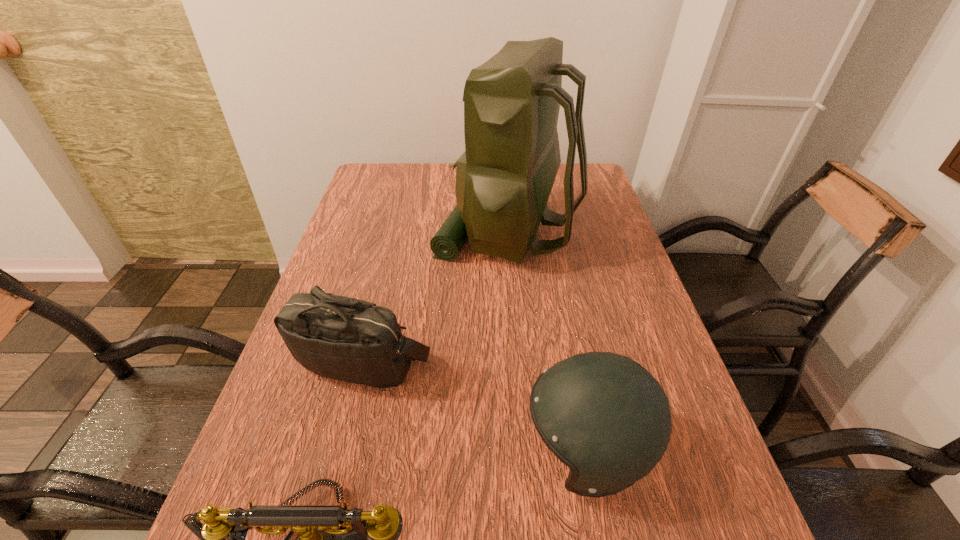
Where is `free space between the football helmet and the third nearest object`? The image size is (960, 540). free space between the football helmet and the third nearest object is located at coordinates (474, 407).

What are the coordinates of `free area in between the second farthest object and the football helmet` in the screenshot? It's located at (474, 407).

Locate an element on the screen. unoccupied position between the second farthest object and the football helmet is located at coordinates (474, 407).

Locate an element on the screen. This screenshot has width=960, height=540. vacant area that lies between the football helmet and the third nearest object is located at coordinates (474, 407).

Find the location of a particular element. This screenshot has width=960, height=540. unoccupied area between the football helmet and the farthest object is located at coordinates (547, 341).

Image resolution: width=960 pixels, height=540 pixels. I want to click on vacant region between the tallest object and the shoulder bag, so click(435, 297).

In order to click on vacant area that lies between the farthest object and the shoulder bag in this screenshot , I will do pyautogui.click(x=435, y=297).

Where is `object that ranks as the second closest to the farthest object`? object that ranks as the second closest to the farthest object is located at coordinates (603, 415).

Identify which object is the closest to the shoulder bag. Please provide its 2D coordinates. Your answer should be formatted as a tuple, i.e. [(x, y)], where the tuple contains the x and y coordinates of a point satisfying the conditions above.

[(323, 539)]

The image size is (960, 540). Identify the location of free location that satisfies the following two spatial constraints: 1. on the front of the backpack with visible pockets; 2. at the front padded panel of the shoulder bag. (518, 362).